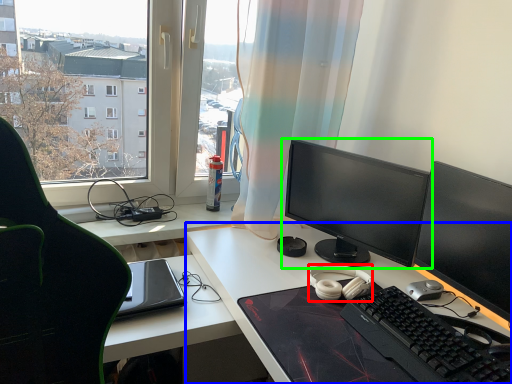
Question: Which is nearer to the headphones (highlighted by a red box)? desk (highlighted by a blue box) or computer monitor (highlighted by a green box).

Choices:
 (A) desk
 (B) computer monitor

Answer: (A)